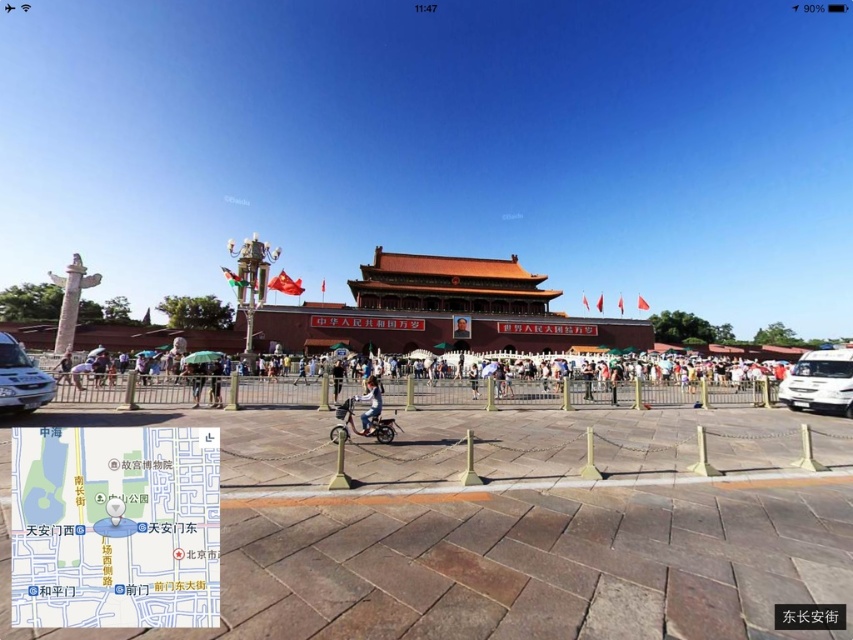
Question: Is brown wooden map at lower left thinner than light blue denim jacket at center?

Choices:
 (A) yes
 (B) no

Answer: (B)

Question: Does white glossy van at right appear under brown stone square at center?

Choices:
 (A) yes
 (B) no

Answer: (B)

Question: Does matte red building at center have a greater width compared to light blue denim jacket at center?

Choices:
 (A) no
 (B) yes

Answer: (B)

Question: Considering the real-world distances, which object is farthest from the white glossy van at right?

Choices:
 (A) light blue denim jacket at center
 (B) matte black person at center
 (C) brown stone square at center

Answer: (B)

Question: Which of the following is the farthest from the observer?

Choices:
 (A) metallic silver bicycle at center
 (B) brown wooden map at lower left
 (C) white glossy van at lower left

Answer: (C)

Question: Which point appears farthest from the camera in this image?

Choices:
 (A) (1, 342)
 (B) (349, 419)
 (C) (375, 392)

Answer: (A)